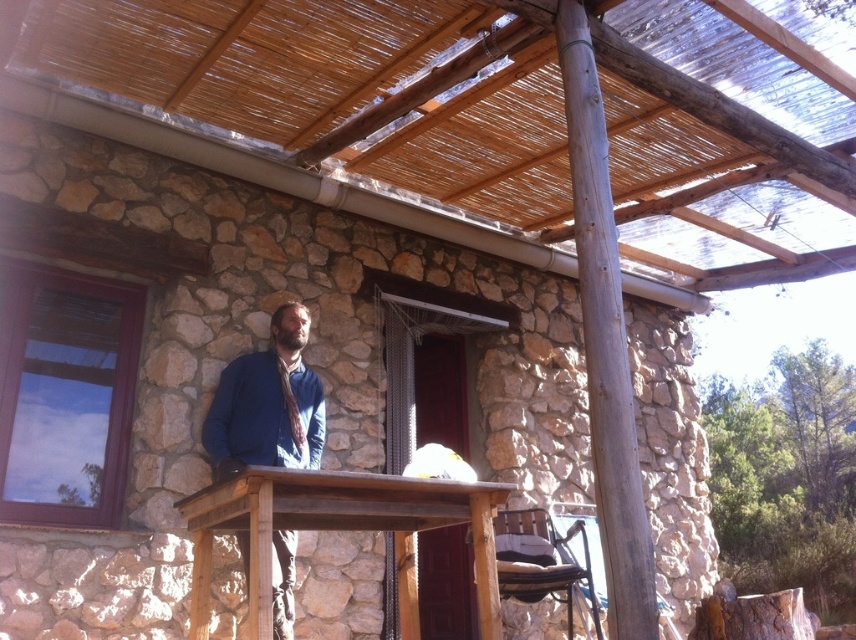
Between rustic wood table at center and blue cotton shirt at center, which one has more height?

rustic wood table at center is taller.

Can you confirm if rustic wood table at center is positioned to the right of blue cotton shirt at center?

Indeed, rustic wood table at center is positioned on the right side of blue cotton shirt at center.

Where is `rustic wood table at center`? This screenshot has height=640, width=856. rustic wood table at center is located at coordinates (337, 529).

Is gray wood pole at upper center smaller than rustic wood table at center?

Yes.

Is gray wood pole at upper center closer to the viewer compared to rustic wood table at center?

Yes, gray wood pole at upper center is in front of rustic wood table at center.

What do you see at coordinates (605, 340) in the screenshot?
I see `gray wood pole at upper center` at bounding box center [605, 340].

At what (x,y) coordinates should I click in order to perform the action: click on gray wood pole at upper center. Please return your answer as a coordinate pair (x, y). This screenshot has height=640, width=856. Looking at the image, I should click on (605, 340).

Does natural thatched roof at upper center have a lesser height compared to gray wood pole at upper center?

Correct, natural thatched roof at upper center is not as tall as gray wood pole at upper center.

Is point (742, 179) farther from viewer compared to point (597, 362)?

Yes.

Where is `natural thatched roof at upper center`? The height and width of the screenshot is (640, 856). natural thatched roof at upper center is located at coordinates (337, 88).

This screenshot has height=640, width=856. What are the coordinates of `natural thatched roof at upper center` in the screenshot? It's located at (337, 88).